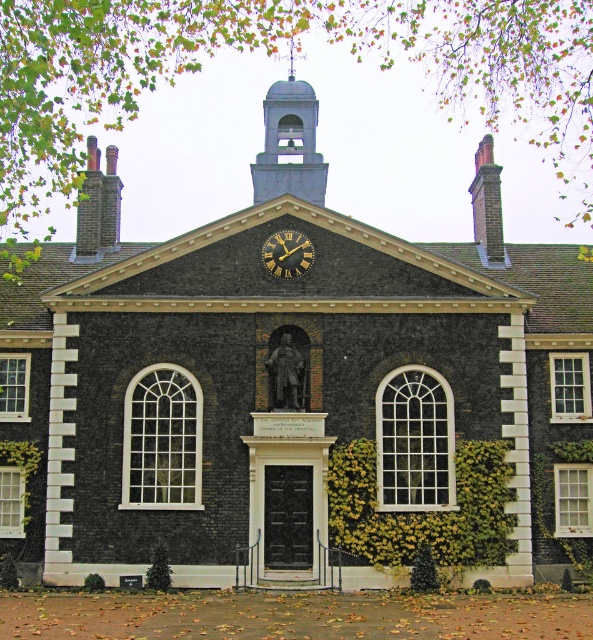
Question: Does white glass window at center-left appear on the left side of metallic gray bell tower at upper center?

Choices:
 (A) no
 (B) yes

Answer: (B)

Question: Is white glass window at center right to the left of metallic gray bell tower at upper center from the viewer's perspective?

Choices:
 (A) yes
 (B) no

Answer: (B)

Question: Which is nearer to the clear glass window at center?

Choices:
 (A) white glass window at center right
 (B) white glass window at center-left
 (C) clear glass window at center left
 (D) gold-toned metal clock at center

Answer: (A)

Question: Is clear glass window at center thinner than white textured window at lower left?

Choices:
 (A) yes
 (B) no

Answer: (A)

Question: Which object is positioned closest to the white textured window at lower left?

Choices:
 (A) white glass window at center-left
 (B) clear glass window at center left
 (C) metallic gray bell tower at upper center

Answer: (B)

Question: Based on their relative distances, which object is nearer to the clear glass window at center?

Choices:
 (A) clear glass window at right
 (B) gold-toned metal clock at center

Answer: (A)